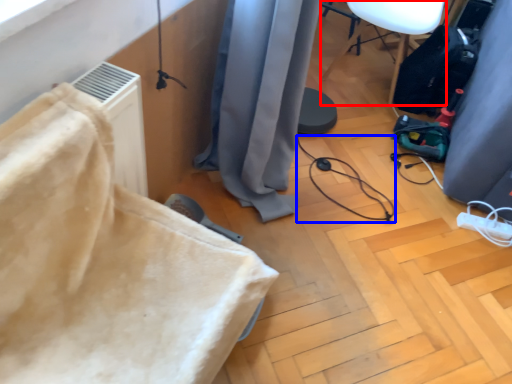
Question: Which object appears farthest to the camera in this image, furniture (highlighted by a red box) or cable (highlighted by a blue box)?

Choices:
 (A) furniture
 (B) cable

Answer: (A)